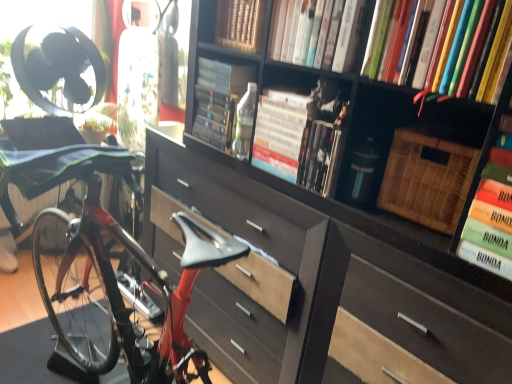
Question: From the image's perspective, is shiny red bicycle at left positioned above or below hardcover book at upper center, which ranks as the fifth book in right-to-left order?

Choices:
 (A) below
 (B) above

Answer: (B)

Question: Considering the positions of shiny red bicycle at left and hardcover book at upper center, which ranks as the fifth book in right-to-left order, in the image, is shiny red bicycle at left wider or thinner than hardcover book at upper center, which ranks as the fifth book in right-to-left order,?

Choices:
 (A) wide
 (B) thin

Answer: (A)

Question: Which object is positioned closest to the green matte book at right, the 1th book viewed from the right?

Choices:
 (A) wooden book at upper center, the 2th book in the left-to-right sequence
 (B) hardcover book at upper center, which ranks as the 3th book in left-to-right order
 (C) hardcover book at upper center, arranged as the 4th book when viewed from the left
 (D) woven brown basket at upper right
 (E) green fabric swivel chair at left

Answer: (D)

Question: Which object is positioned farthest from the hardcover book at upper center, arranged as the 4th book when viewed from the left?

Choices:
 (A) dark wood bookcase at center
 (B) wooden book at upper center, the 6th book when ordered from right to left
 (C) hardcover book at center, which is the 1th book from left to right
 (D) hardcover books at upper right, the 6th book in the left-to-right sequence
 (E) green fabric swivel chair at left

Answer: (E)